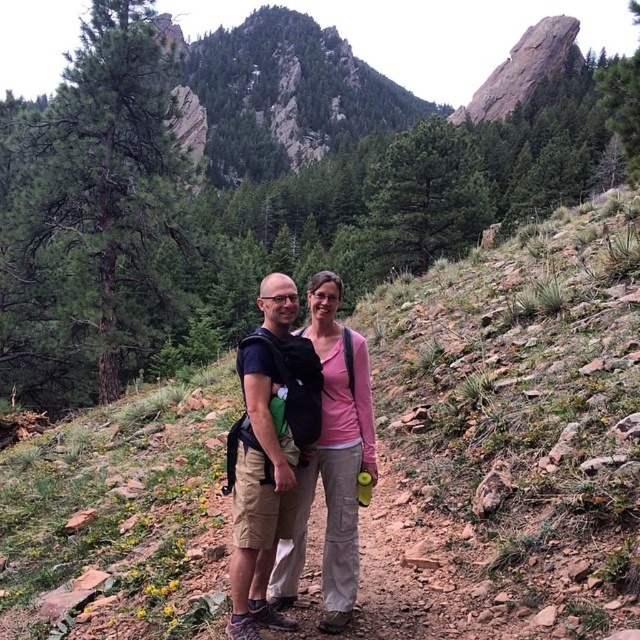
Does green grassy hillside at center have a larger size compared to matte black backpack at center?

Yes.

Does point (404, 326) lie behind point (276, 545)?

Yes, point (404, 326) is behind point (276, 545).

Is point (467, 324) closer to viewer compared to point (259, 573)?

No.

Identify the location of green grassy hillside at center. (502, 442).